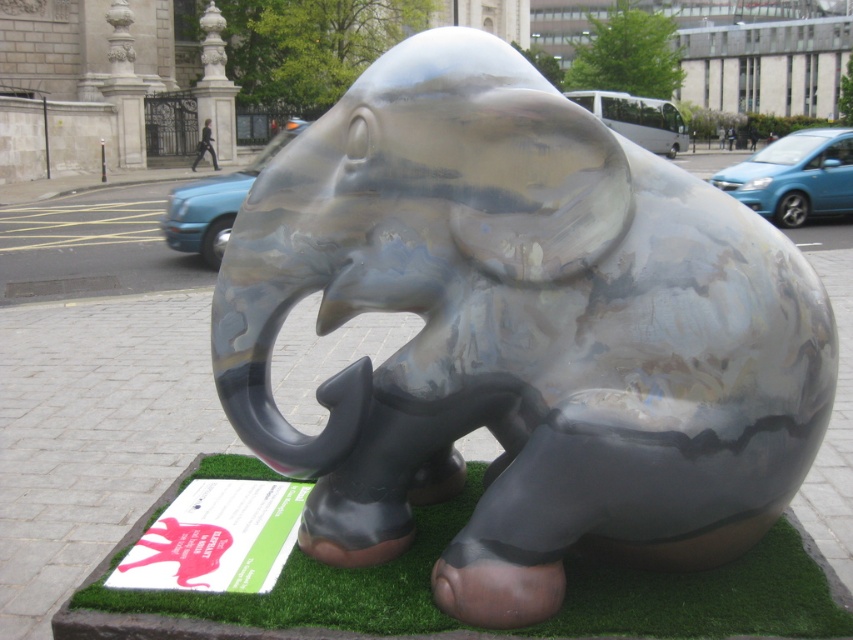
Can you confirm if shiny metallic elephant at center is positioned to the left of green artificial turf at lower center?

Incorrect, shiny metallic elephant at center is not on the left side of green artificial turf at lower center.

Which is more to the left, shiny metallic elephant at center or green artificial turf at lower center?

From the viewer's perspective, green artificial turf at lower center appears more on the left side.

Identify the location of shiny metallic elephant at center. This screenshot has height=640, width=853. pos(521,333).